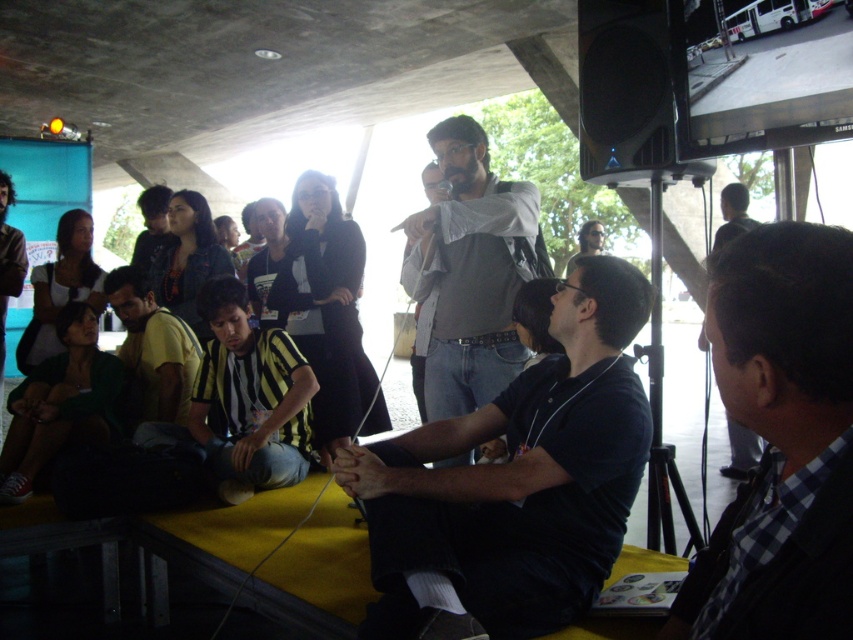
This screenshot has height=640, width=853. What are the coordinates of `black checkered shirt at lower right` in the screenshot? It's located at (780, 438).

Which is behind, point (746, 518) or point (427, 328)?

The point (427, 328) is more distant.

Image resolution: width=853 pixels, height=640 pixels. What do you see at coordinates (780, 438) in the screenshot? I see `black checkered shirt at lower right` at bounding box center [780, 438].

At what (x,y) coordinates should I click in order to perform the action: click on black checkered shirt at lower right. Please return your answer as a coordinate pair (x, y). Looking at the image, I should click on (780, 438).

Is point (444, 310) closer to camera compared to point (585, 246)?

Yes, point (444, 310) is in front of point (585, 246).

Does gray shirt at center have a greater height compared to matte gray shirt at center?

Correct, gray shirt at center is much taller as matte gray shirt at center.

Describe the element at coordinates (469, 273) in the screenshot. I see `gray shirt at center` at that location.

The image size is (853, 640). I want to click on gray shirt at center, so click(469, 273).

Is black matte shirt at center taller than gray shirt at center?

In fact, black matte shirt at center may be shorter than gray shirt at center.

Which is behind, point (621, 317) or point (428, 406)?

Positioned behind is point (428, 406).

Is point (608, 467) positioned after point (482, 291)?

No, (608, 467) is in front of (482, 291).

This screenshot has height=640, width=853. Identify the location of black matte shirt at center. (518, 476).